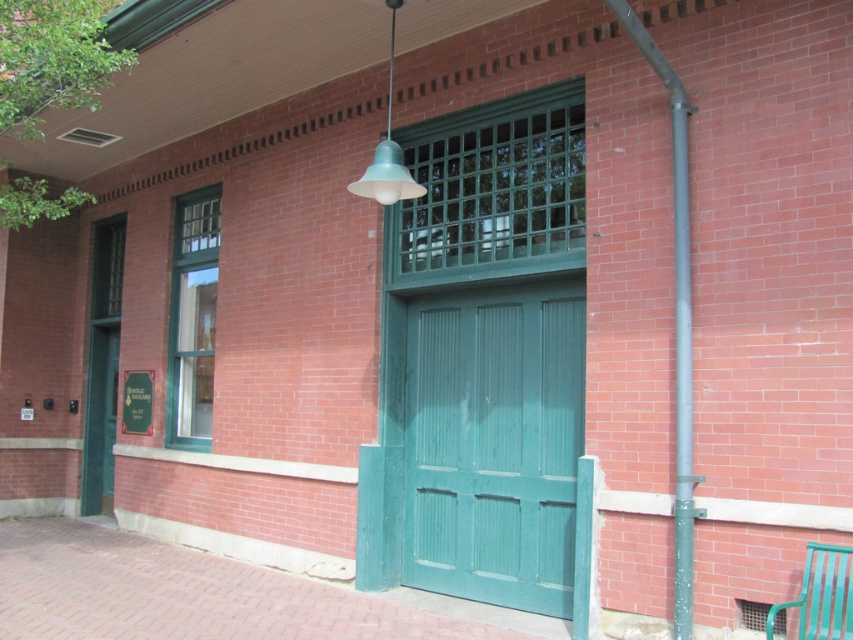
You are a painter who needs to decide which object to paint first between the metallic gray pipe at right and the green metal bench at lower right. Since you want to start with the larger object, which one should you choose?

The metallic gray pipe at right is larger in size than the green metal bench at lower right, so you should start painting the metallic gray pipe at right first.

You are standing in front of the brick building and notice two points marked on the facade. The first point is at coordinate point(819, 550) and the second is at point(396, 180). Which point is closer to you?

Point(819, 550) is in front of point(396, 180), so it is closer to you.

You are a visitor approaching the building and want to sit down. The metallic gray pipe at right and the green metal bench at lower right are both visible. Which one is closer to the entrance?

The metallic gray pipe at right is closer to the entrance because it is positioned to the left of the green metal bench at lower right, which is further away.